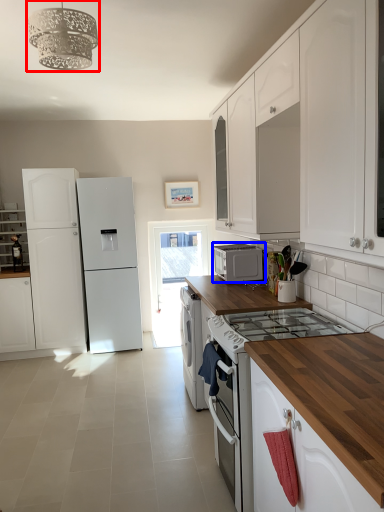
Question: Which object is further to the camera taking this photo, light fixture (highlighted by a red box) or microwave oven (highlighted by a blue box)?

Choices:
 (A) light fixture
 (B) microwave oven

Answer: (B)